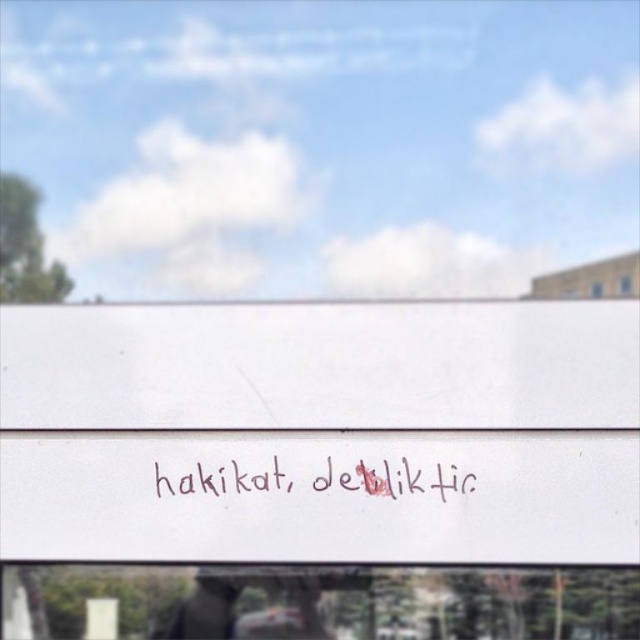
You are a painter who wants to paint over the handwritten text at center without covering the transparent glass window at lower center. Is this possible given their positions?

The transparent glass window at lower center is in front of the handwritten text at center, so you cannot paint over the handwritten text at center without also covering the transparent glass window at lower center.

You are an interior designer assessing the placement of the transparent glass window at lower center and the handwritten text at center. Which object takes up more space in the image?

The transparent glass window at lower center has a larger size compared to the handwritten text at center, so it takes up more space in the image.

Consider the image. You are standing in a room where the wall has a white surface with red text. You notice a point at coordinates (317, 602). What does this point indicate?

The point at coordinates (317, 602) indicates the location of a transparent glass window at lower center.